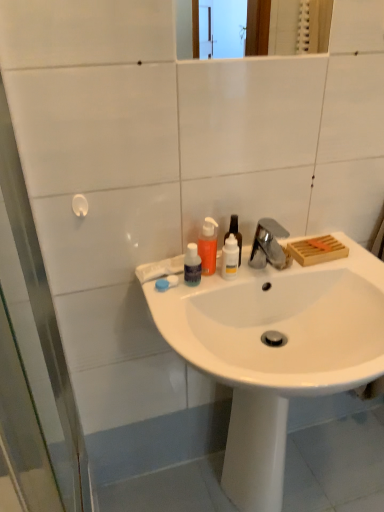
Where is `vacant area that is in front of transparent plastic bottle at center, which is the fourth bottle in right-to-left order`? This screenshot has width=384, height=512. vacant area that is in front of transparent plastic bottle at center, which is the fourth bottle in right-to-left order is located at coordinates (179, 321).